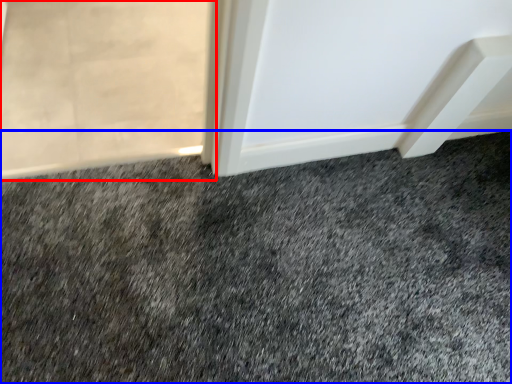
Question: Which object appears closest to the camera in this image, screen door (highlighted by a red box) or granite (highlighted by a blue box)?

Choices:
 (A) screen door
 (B) granite

Answer: (B)